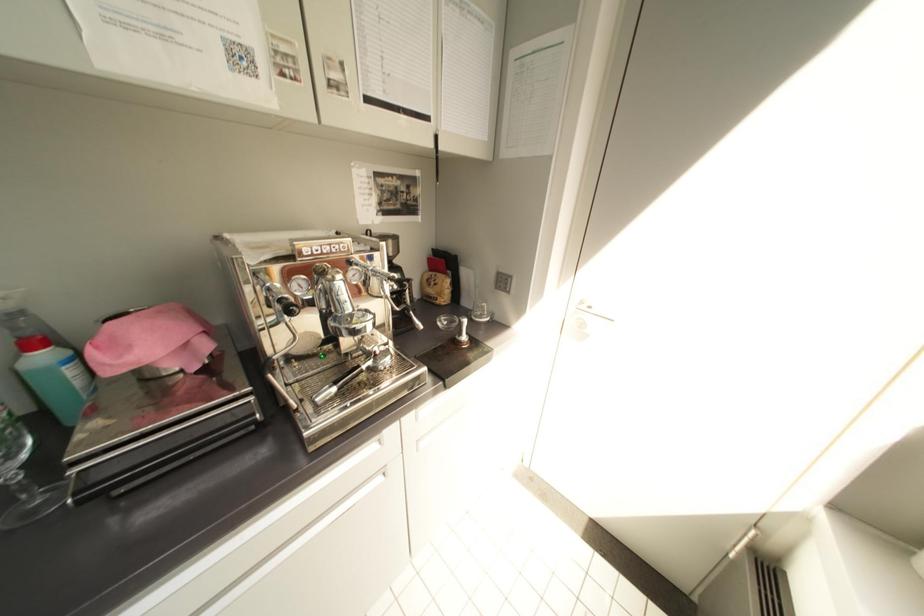
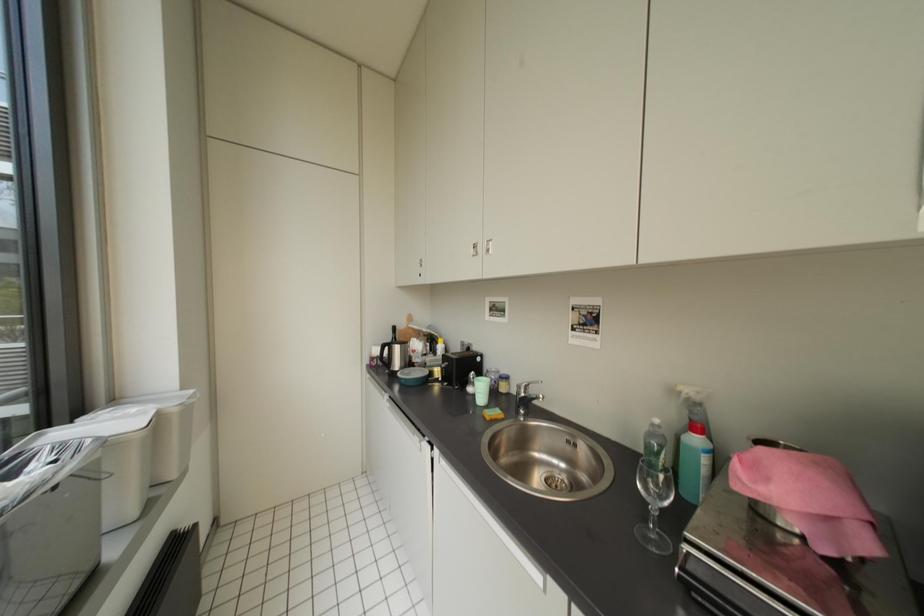
Question: How did the camera likely rotate?

Choices:
 (A) Left
 (B) Right
 (C) Up
 (D) Down

Answer: (A)